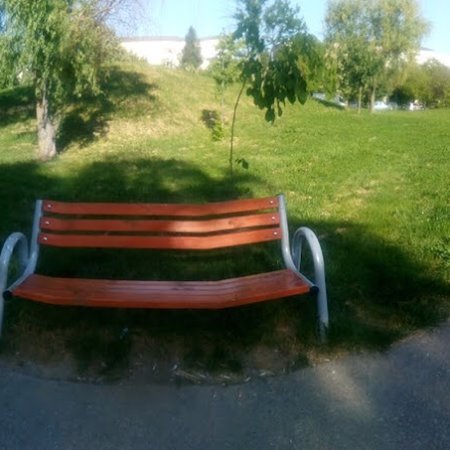
This screenshot has width=450, height=450. I want to click on armrests, so click(x=318, y=258), click(x=9, y=245).